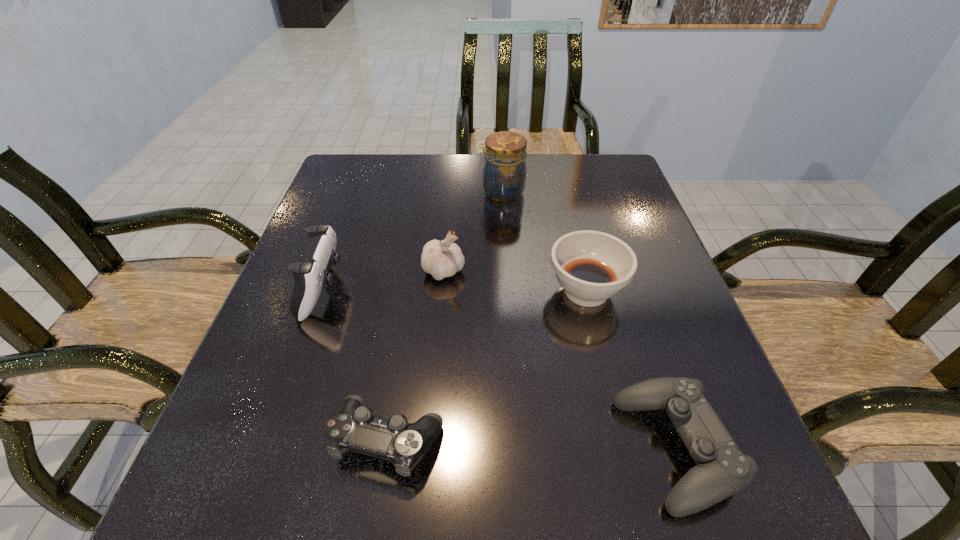
Locate an element on the screen. This screenshot has width=960, height=540. object at the near right corner is located at coordinates (722, 470).

The height and width of the screenshot is (540, 960). In the image, there is a desktop. Identify the location of vacant space at the far edge. (417, 198).

The height and width of the screenshot is (540, 960). In the image, there is a desktop. What are the coordinates of `vacant space at the near edge` in the screenshot? It's located at (414, 510).

Find the location of a particular element. Image resolution: width=960 pixels, height=540 pixels. vacant space at the left edge is located at coordinates (229, 407).

At what (x,y) coordinates should I click in order to perform the action: click on blank space at the right edge of the desktop. Please return your answer as a coordinate pair (x, y). This screenshot has height=540, width=960. Looking at the image, I should click on (698, 327).

Where is `free space at the far left corner of the desktop`? The width and height of the screenshot is (960, 540). free space at the far left corner of the desktop is located at coordinates (377, 160).

This screenshot has height=540, width=960. What are the coordinates of `vacant space at the near left corner of the desktop` in the screenshot? It's located at (302, 485).

You are a GUI agent. You are given a task and a screenshot of the screen. Output one action in this format:
    pyautogui.click(x=<x>, y=<y>)
    Task: Click on the empty location between the garlic and the third shortest object
    
    Given the screenshot: What is the action you would take?
    pyautogui.click(x=515, y=281)

At what (x,y) coordinates should I click in order to perform the action: click on free point between the second control from left to right and the fourth object from left to right. Please return your answer as a coordinate pair (x, y). This screenshot has height=540, width=960. Looking at the image, I should click on (445, 315).

I want to click on vacant area between the rightmost control and the third shortest object, so click(631, 370).